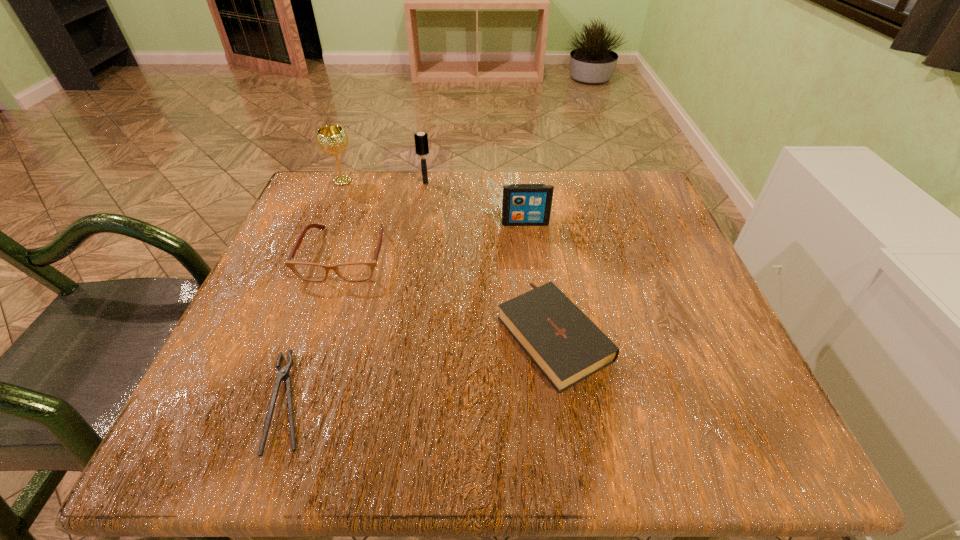
The width and height of the screenshot is (960, 540). In order to click on free space between the fourth object from left to right and the iPod in this screenshot , I will do `click(475, 203)`.

Locate an element on the screen. The height and width of the screenshot is (540, 960). vacant area that lies between the third object from right to left and the shortest object is located at coordinates (357, 292).

Image resolution: width=960 pixels, height=540 pixels. Identify the location of vacant area between the spectacles and the third object from right to left. (385, 219).

The height and width of the screenshot is (540, 960). Identify the location of vacant area that lies between the third tallest object and the shortest object. (407, 312).

What are the coordinates of `unoccupied area between the fourth shortest object and the shortest object` in the screenshot? It's located at (407, 312).

Locate an element on the screen. free space that is in between the chalice and the fourth shortest object is located at coordinates (434, 202).

Identify the location of unoccupied area between the tongs and the chalice. The width and height of the screenshot is (960, 540). (315, 291).

Where is `vacant region between the third shortest object and the chalice`? The image size is (960, 540). vacant region between the third shortest object and the chalice is located at coordinates (344, 218).

Identify the location of vacant space that's between the chalice and the hairbrush. This screenshot has height=540, width=960. (384, 181).

The height and width of the screenshot is (540, 960). I want to click on empty location between the third shortest object and the hairbrush, so click(385, 219).